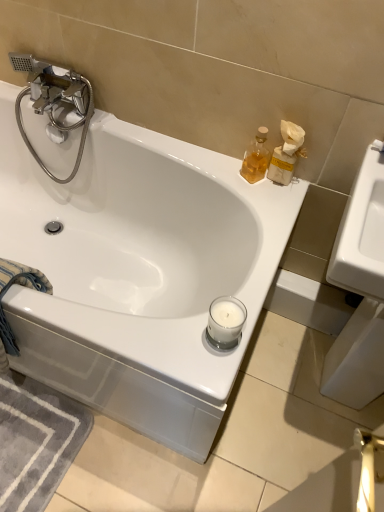
In order to face translucent glass soap dispenser at upper right, should I rotate leftwards or rightwards?

Turn right approximately 8.674 degrees to face it.

What do you see at coordinates (54, 101) in the screenshot? I see `chrome/metallic faucet at upper left` at bounding box center [54, 101].

Measure the distance between point (35,158) and camera.

Point (35,158) and camera are 5.22 feet apart from each other.

The height and width of the screenshot is (512, 384). Find the location of `white glossy bathtub at upper center`. white glossy bathtub at upper center is located at coordinates (138, 272).

From the image's perspective, is translucent glass soap dispenser at upper right beneath white glossy bathtub at upper center?

Incorrect, from the image's perspective, translucent glass soap dispenser at upper right is higher than white glossy bathtub at upper center.

Considering the sizes of objects translucent glass soap dispenser at upper right and white glossy bathtub at upper center in the image provided, who is bigger, translucent glass soap dispenser at upper right or white glossy bathtub at upper center?

Bigger between the two is white glossy bathtub at upper center.

How many degrees apart are the facing directions of translucent glass soap dispenser at upper right and white glossy bathtub at upper center?

The angular difference between translucent glass soap dispenser at upper right and white glossy bathtub at upper center is 31.4 degrees.

Would you say white glossy bathtub at upper center is part of translucent glass soap dispenser at upper right's contents?

No, white glossy bathtub at upper center is located outside of translucent glass soap dispenser at upper right.

From the image's perspective, who appears lower, blue cotton towel at lower left or white glossy bathtub at upper center?

From the image's view, blue cotton towel at lower left is below.

Is blue cotton towel at lower left taller than white glossy bathtub at upper center?

No, blue cotton towel at lower left is not taller than white glossy bathtub at upper center.

Considering the sizes of blue cotton towel at lower left and white glossy bathtub at upper center in the image, is blue cotton towel at lower left wider or thinner than white glossy bathtub at upper center?

In the image, blue cotton towel at lower left appears to be more narrow than white glossy bathtub at upper center.

Is point (6, 348) positioned behind point (63, 225)?

No, (6, 348) is in front of (63, 225).

Is white glossy bathtub at upper center to the left of chrome/metallic faucet at upper left from the viewer's perspective?

In fact, white glossy bathtub at upper center is to the right of chrome/metallic faucet at upper left.

Considering the points (131, 260) and (39, 94), which point is in front, point (131, 260) or point (39, 94)?

The point (39, 94) is more forward.

From the image's perspective, which is above, white glossy bathtub at upper center or chrome/metallic faucet at upper left?

chrome/metallic faucet at upper left.

Are white glossy bathtub at upper center and chrome/metallic faucet at upper left located far from each other?

No, white glossy bathtub at upper center is not far away from chrome/metallic faucet at upper left.

Which of these two, chrome/metallic faucet at upper left or white glossy bathtub at upper center, is wider?

With larger width is white glossy bathtub at upper center.

Measure the distance between chrome/metallic faucet at upper left and white glossy bathtub at upper center.

chrome/metallic faucet at upper left and white glossy bathtub at upper center are 38.73 centimeters apart from each other.

Is point (28, 139) behind point (210, 292)?

Yes, point (28, 139) is farther from viewer.

Is chrome/metallic faucet at upper left positioned with its back to white glossy bathtub at upper center?

Yes, chrome/metallic faucet at upper left's orientation is away from white glossy bathtub at upper center.

From the image's perspective, is chrome/metallic faucet at upper left positioned above or below translucent glass soap dispenser at upper right?

Clearly, from the image's perspective, chrome/metallic faucet at upper left is above translucent glass soap dispenser at upper right.

Is chrome/metallic faucet at upper left behind translucent glass soap dispenser at upper right?

Yes.

Does chrome/metallic faucet at upper left have a lesser height compared to translucent glass soap dispenser at upper right?

No, chrome/metallic faucet at upper left is not shorter than translucent glass soap dispenser at upper right.

Considering the sizes of objects chrome/metallic faucet at upper left and translucent glass soap dispenser at upper right in the image provided, who is smaller, chrome/metallic faucet at upper left or translucent glass soap dispenser at upper right?

Smaller between the two is translucent glass soap dispenser at upper right.

From their relative heights in the image, would you say translucent glass soap dispenser at upper right is taller or shorter than chrome/metallic faucet at upper left?

Considering their sizes, translucent glass soap dispenser at upper right has less height than chrome/metallic faucet at upper left.

From the picture: Visually, is translucent glass soap dispenser at upper right positioned to the left or to the right of chrome/metallic faucet at upper left?

Clearly, translucent glass soap dispenser at upper right is on the right of chrome/metallic faucet at upper left in the image.

Is translucent glass soap dispenser at upper right facing towards chrome/metallic faucet at upper left?

No, translucent glass soap dispenser at upper right is not oriented towards chrome/metallic faucet at upper left.

What's the angular difference between translucent glass soap dispenser at upper right and chrome/metallic faucet at upper left's facing directions?

30.7 degrees.

Is blue cotton towel at lower left far away from chrome/metallic faucet at upper left?

Actually, blue cotton towel at lower left and chrome/metallic faucet at upper left are a little close together.

Which point is more distant from viewer, (1, 296) or (52, 95)?

The point (52, 95) is behind.

Image resolution: width=384 pixels, height=512 pixels. What are the coordinates of `tap above the blue cotton towel at lower left (from a real-world perspective)` in the screenshot? It's located at (54, 101).

From the image's perspective, between blue cotton towel at lower left and chrome/metallic faucet at upper left, which one is located above?

chrome/metallic faucet at upper left, from the image's perspective.

Locate an element on the screen. Image resolution: width=384 pixels, height=512 pixels. bathtub below the translucent glass soap dispenser at upper right (from a real-world perspective) is located at coordinates (138, 272).

The width and height of the screenshot is (384, 512). I want to click on bathtub that appears above the blue cotton towel at lower left (from the image's perspective), so click(x=138, y=272).

Estimate the real-world distances between objects in this image. Which object is closer to white glossy bathtub at upper center, translucent glass soap dispenser at upper right or chrome/metallic faucet at upper left?

Among the two, chrome/metallic faucet at upper left is located nearer to white glossy bathtub at upper center.

Which object lies further to the anchor point translucent glass soap dispenser at upper right, blue cotton towel at lower left or chrome/metallic faucet at upper left?

The object further to translucent glass soap dispenser at upper right is blue cotton towel at lower left.

From the image, which object appears to be nearer to white glossy bathtub at upper center, blue cotton towel at lower left or chrome/metallic faucet at upper left?

Among the two, chrome/metallic faucet at upper left is located nearer to white glossy bathtub at upper center.

From the image, which object appears to be nearer to chrome/metallic faucet at upper left, white glossy bathtub at upper center or blue cotton towel at lower left?

The object closer to chrome/metallic faucet at upper left is white glossy bathtub at upper center.

Based on their spatial positions, is white glossy bathtub at upper center or chrome/metallic faucet at upper left closer to blue cotton towel at lower left?

The object closer to blue cotton towel at lower left is white glossy bathtub at upper center.

When comparing their distances from chrome/metallic faucet at upper left, does translucent glass soap dispenser at upper right or white glossy bathtub at upper center seem closer?

white glossy bathtub at upper center.

In the scene shown: Which object lies nearer to the anchor point white glossy bathtub at upper center, blue cotton towel at lower left or translucent glass soap dispenser at upper right?

Among the two, blue cotton towel at lower left is located nearer to white glossy bathtub at upper center.

Which object lies further to the anchor point chrome/metallic faucet at upper left, blue cotton towel at lower left or translucent glass soap dispenser at upper right?

Among the two, translucent glass soap dispenser at upper right is located further to chrome/metallic faucet at upper left.

This screenshot has width=384, height=512. I want to click on bathtub between chrome/metallic faucet at upper left and translucent glass soap dispenser at upper right in the horizontal direction, so click(138, 272).

In order to click on bathtub between chrome/metallic faucet at upper left and blue cotton towel at lower left in the up-down direction in this screenshot , I will do `click(138, 272)`.

I want to click on tap situated between blue cotton towel at lower left and translucent glass soap dispenser at upper right from left to right, so click(x=54, y=101).

Image resolution: width=384 pixels, height=512 pixels. In order to click on bathtub between blue cotton towel at lower left and translucent glass soap dispenser at upper right in this screenshot , I will do [x=138, y=272].